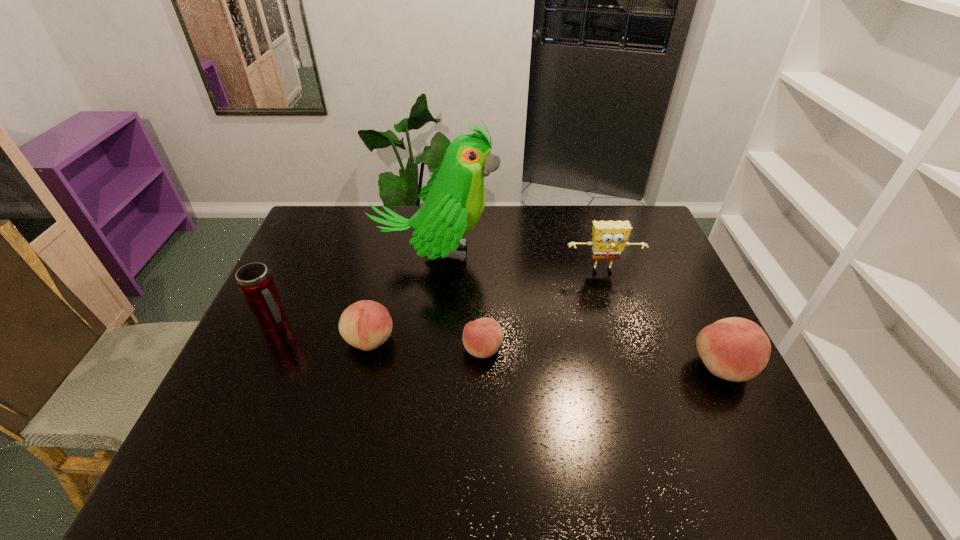
To make them evenly spaced by inserting another peach among them, please locate a vacant spot for this new peach. Please provide its 2D coordinates. Your answer should be formatted as a tuple, i.e. [(x, y)], where the tuple contains the x and y coordinates of a point satisfying the conditions above.

[(601, 358)]